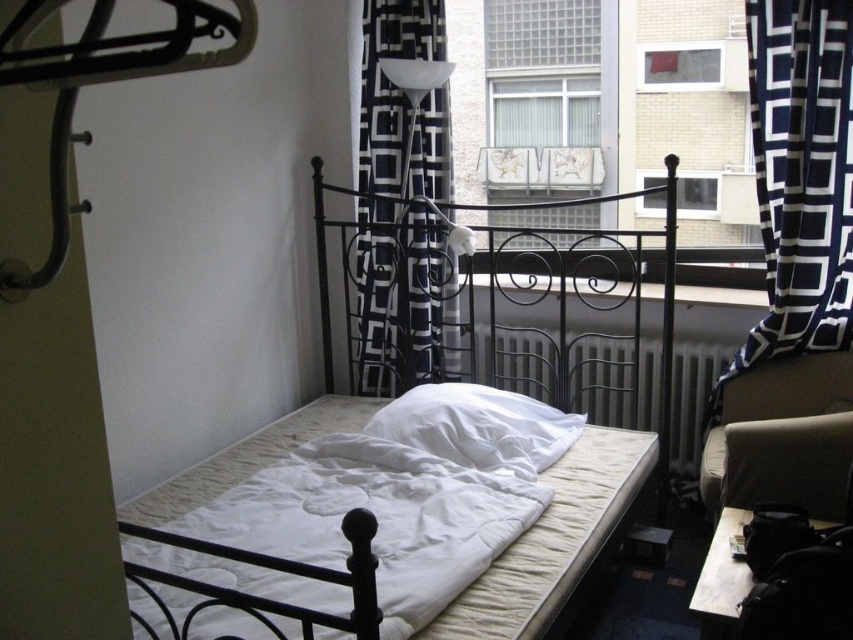
You are standing at the origin point in the room. Where is the white fabric bed at center located in terms of coordinates?

The white fabric bed at center is located at coordinates point [386,525].